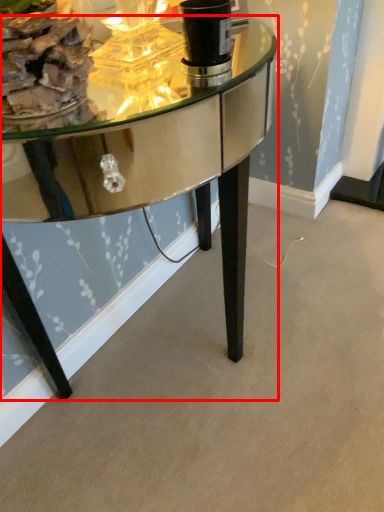
Question: In this image, where is table (annotated by the red box) located relative to food?

Choices:
 (A) right
 (B) left

Answer: (A)